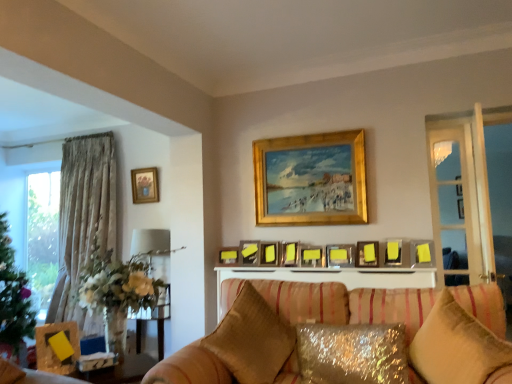
Question: Should I look upward or downward to see sparkly gold pillow at lower center, which appears as the second pillow when viewed from the right?

Choices:
 (A) down
 (B) up

Answer: (A)

Question: Can you confirm if wooden picture frame at left, which is the twelfth picture frame in back-to-front order, is positioned to the right of sparkly gold pillow at lower center, the second pillow in the left-to-right sequence?

Choices:
 (A) no
 (B) yes

Answer: (A)

Question: Can sparkly gold pillow at lower center, which appears as the second pillow when viewed from the right, be found inside wooden picture frame at left, which is counted as the first picture frame, starting from the front?

Choices:
 (A) no
 (B) yes

Answer: (A)

Question: Is wooden picture frame at left, the 2th picture frame positioned from the left, to the left of sparkly gold pillow at lower center, the second pillow in the left-to-right sequence, from the viewer's perspective?

Choices:
 (A) no
 (B) yes

Answer: (B)

Question: Is wooden picture frame at left, which is the twelfth picture frame in back-to-front order, positioned behind sparkly gold pillow at lower center, which appears as the second pillow when viewed from the right?

Choices:
 (A) yes
 (B) no

Answer: (A)

Question: Considering the relative sizes of wooden picture frame at left, which ranks as the 11th picture frame in right-to-left order, and sparkly gold pillow at lower center, which appears as the second pillow when viewed from the right, in the image provided, is wooden picture frame at left, which ranks as the 11th picture frame in right-to-left order, thinner than sparkly gold pillow at lower center, which appears as the second pillow when viewed from the right,?

Choices:
 (A) no
 (B) yes

Answer: (B)

Question: Can we say wooden picture frame at left, which ranks as the 11th picture frame in right-to-left order, lies outside sparkly gold pillow at lower center, the second pillow in the left-to-right sequence?

Choices:
 (A) no
 (B) yes

Answer: (B)

Question: Is metallic silver picture frame at center, arranged as the tenth picture frame when viewed from the right, smaller than wooden picture frame at left, the 2th picture frame positioned from the left?

Choices:
 (A) yes
 (B) no

Answer: (A)

Question: Is metallic silver picture frame at center, acting as the second picture frame starting from the back, in front of wooden picture frame at left, the 2th picture frame positioned from the left?

Choices:
 (A) yes
 (B) no

Answer: (B)

Question: From a real-world perspective, is metallic silver picture frame at center, which is counted as the 3th picture frame, starting from the left, beneath wooden picture frame at left, the 2th picture frame positioned from the left?

Choices:
 (A) no
 (B) yes

Answer: (A)

Question: Would you say metallic silver picture frame at center, acting as the second picture frame starting from the back, contains wooden picture frame at left, the 2th picture frame positioned from the left?

Choices:
 (A) yes
 (B) no

Answer: (B)

Question: Is wooden picture frame at left, which ranks as the 11th picture frame in right-to-left order, at the back of metallic silver picture frame at center, which is counted as the 3th picture frame, starting from the left?

Choices:
 (A) no
 (B) yes

Answer: (A)

Question: Would you consider metallic silver picture frame at center, the 11th picture frame when ordered from front to back, to be distant from wooden picture frame at left, which ranks as the 11th picture frame in right-to-left order?

Choices:
 (A) yes
 (B) no

Answer: (A)

Question: Is yellow matte picture frame at upper center, arranged as the 2th picture frame when viewed from the front, smaller than gold-framed picture at upper left, marked as the twelfth picture frame in a right-to-left arrangement?

Choices:
 (A) yes
 (B) no

Answer: (A)